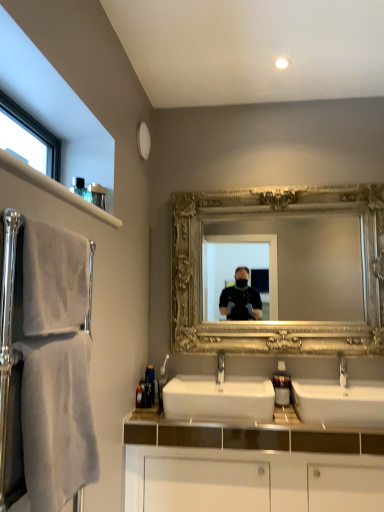
Question: Does white textured towel at left, which is counted as the 2th bath towel, starting from the bottom, have a smaller size compared to white soft towel at left, marked as the 2th bath towel in a top-to-bottom arrangement?

Choices:
 (A) yes
 (B) no

Answer: (A)

Question: Is white textured towel at left, which is counted as the 2th bath towel, starting from the bottom, facing away from white soft towel at left, marked as the 2th bath towel in a top-to-bottom arrangement?

Choices:
 (A) no
 (B) yes

Answer: (A)

Question: From the image's perspective, is white textured towel at left, the 1th bath towel in the top-to-bottom sequence, above white soft towel at left, marked as the 2th bath towel in a top-to-bottom arrangement?

Choices:
 (A) yes
 (B) no

Answer: (A)

Question: Can you confirm if white textured towel at left, the 1th bath towel in the top-to-bottom sequence, is positioned to the right of white soft towel at left, acting as the 1th bath towel starting from the bottom?

Choices:
 (A) no
 (B) yes

Answer: (A)

Question: From a real-world perspective, is white textured towel at left, the 1th bath towel in the top-to-bottom sequence, beneath white soft towel at left, marked as the 2th bath towel in a top-to-bottom arrangement?

Choices:
 (A) no
 (B) yes

Answer: (A)

Question: Is white textured towel at left, the 1th bath towel in the top-to-bottom sequence, to the left of white soft towel at left, acting as the 1th bath towel starting from the bottom, from the viewer's perspective?

Choices:
 (A) no
 (B) yes

Answer: (B)

Question: From a real-world perspective, is white ceramic sink at center, which is the second sink from left to right, physically below silver metallic faucet at center?

Choices:
 (A) no
 (B) yes

Answer: (B)

Question: Does white ceramic sink at center, which is the second sink from left to right, touch silver metallic faucet at center?

Choices:
 (A) no
 (B) yes

Answer: (A)

Question: Is there a large distance between white ceramic sink at center, which is counted as the 1th sink, starting from the right, and silver metallic faucet at center?

Choices:
 (A) yes
 (B) no

Answer: (B)

Question: From the image's perspective, is white ceramic sink at center, which is the second sink from left to right, over silver metallic faucet at center?

Choices:
 (A) no
 (B) yes

Answer: (A)

Question: Is white ceramic sink at center, which is the second sink from left to right, outside silver metallic faucet at center?

Choices:
 (A) no
 (B) yes

Answer: (B)

Question: Is silver metallic faucet at center at the back of white ceramic sink at center, which is the second sink from left to right?

Choices:
 (A) no
 (B) yes

Answer: (A)

Question: Considering the relative sizes of silver metallic faucet at center and white ceramic sink at center, which is counted as the 1th sink, starting from the right, in the image provided, is silver metallic faucet at center wider than white ceramic sink at center, which is counted as the 1th sink, starting from the right,?

Choices:
 (A) no
 (B) yes

Answer: (A)